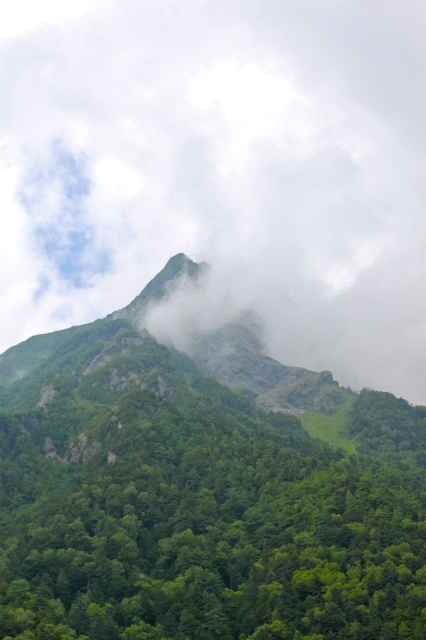
From the picture: Who is shorter, white fluffy cloud at upper center or green leafy tree at center?

With less height is green leafy tree at center.

Does white fluffy cloud at upper center lie in front of green leafy tree at center?

That is False.

At what (x,y) coordinates should I click in order to perform the action: click on white fluffy cloud at upper center. Please return your answer as a coordinate pair (x, y). The width and height of the screenshot is (426, 640). Looking at the image, I should click on (221, 168).